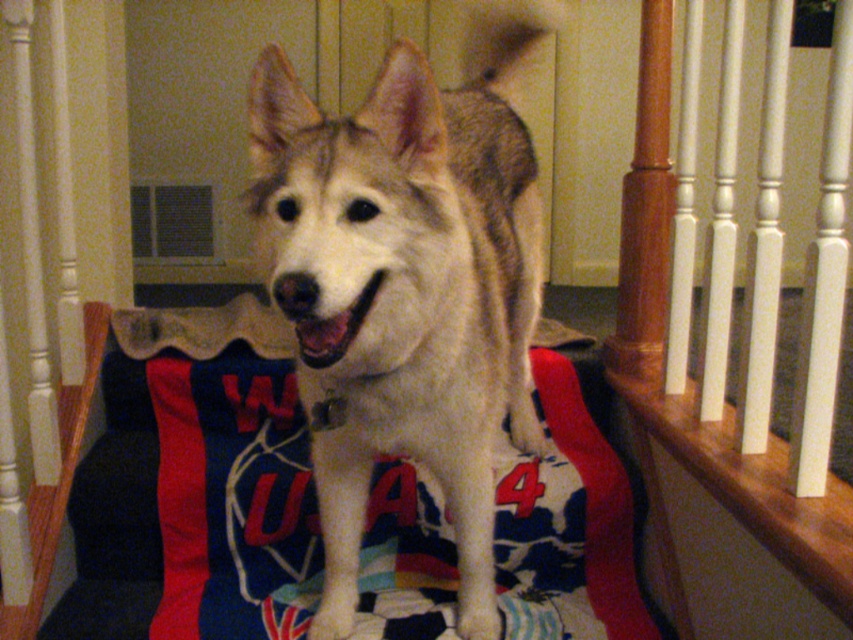
Question: Which object is positioned farthest from the white wood railing at upper center?

Choices:
 (A) red and blue striped fabric at center
 (B) white fur dog at center

Answer: (A)

Question: Is white fur dog at center smaller than white wood railing at upper center?

Choices:
 (A) yes
 (B) no

Answer: (B)

Question: Does white fur dog at center have a lesser width compared to white wood railing at upper center?

Choices:
 (A) yes
 (B) no

Answer: (B)

Question: Which point appears farthest from the camera in this image?

Choices:
 (A) (840, 125)
 (B) (428, 204)

Answer: (B)

Question: Which object is closer to the camera taking this photo?

Choices:
 (A) white wood railing at upper center
 (B) white fur dog at center

Answer: (B)

Question: Can you confirm if white fur dog at center is wider than red and blue striped fabric at center?

Choices:
 (A) no
 (B) yes

Answer: (A)